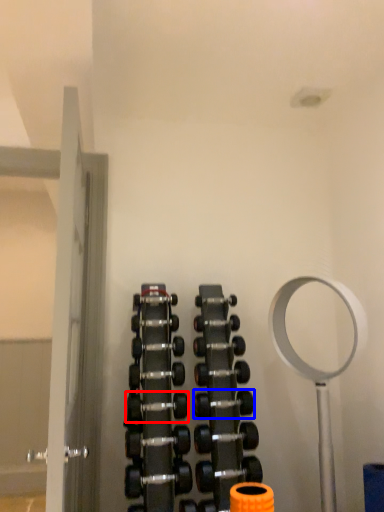
Question: Among these objects, which one is farthest to the camera, dumbbell (highlighted by a red box) or dumbbell (highlighted by a blue box)?

Choices:
 (A) dumbbell
 (B) dumbbell

Answer: (B)